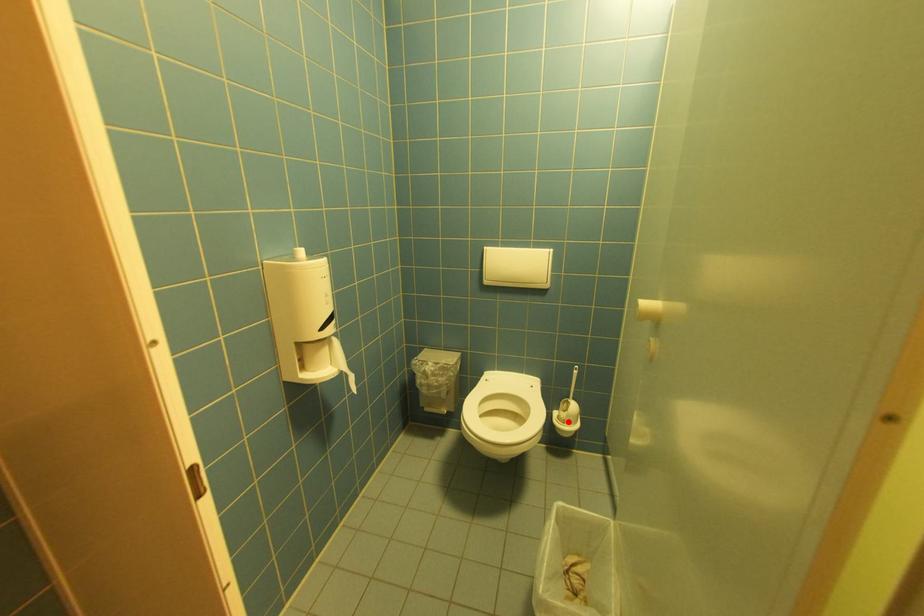
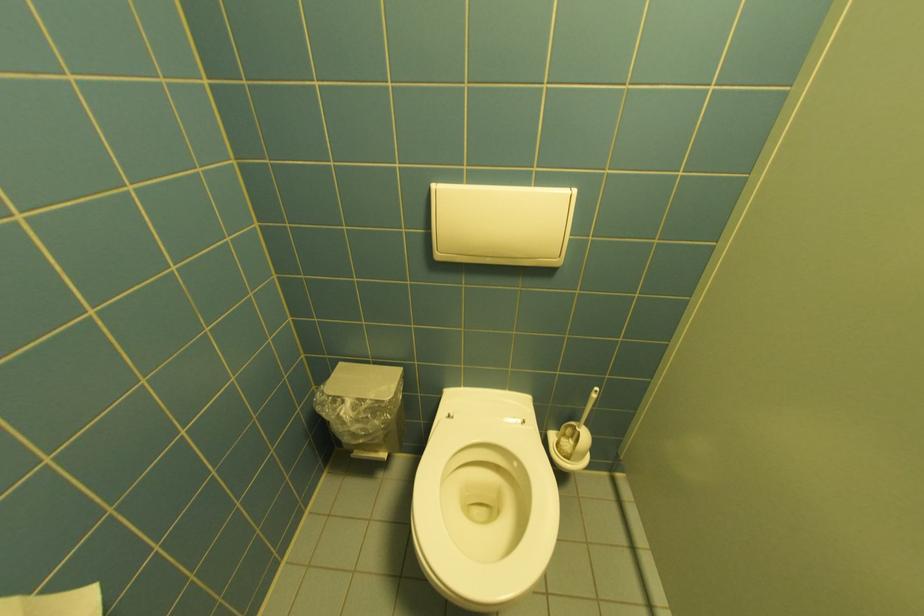
The point at the highlighted location is marked in the first image. Where is the corresponding point in the second image?

(570, 455)